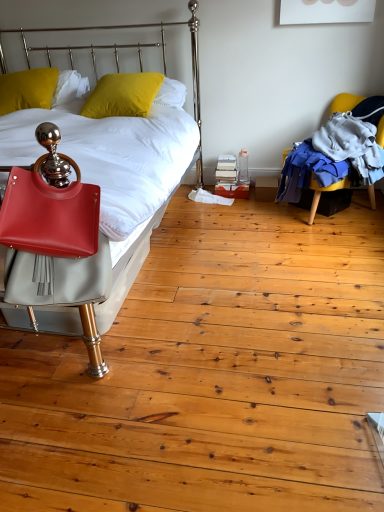
Question: In terms of width, does yellow matte pillow at upper left, which is the first pillow in right-to-left order, look wider or thinner when compared to matte leather bed at left?

Choices:
 (A) wide
 (B) thin

Answer: (B)

Question: Is yellow matte pillow at upper left, the 2th pillow viewed from the left, taller or shorter than matte leather bed at left?

Choices:
 (A) short
 (B) tall

Answer: (A)

Question: Considering the real-world distances, which object is closest to the matte leather bed at left?

Choices:
 (A) matte red handbag at left
 (B) yellow fabric chair at right
 (C) yellow matte pillow at upper left, which is the first pillow in right-to-left order
 (D) yellow matte pillow at upper left, which is counted as the 1th pillow, starting from the left

Answer: (A)

Question: Which is nearer to the yellow matte pillow at upper left, which is the first pillow in right-to-left order?

Choices:
 (A) yellow fabric chair at right
 (B) matte leather bed at left
 (C) matte red handbag at left
 (D) yellow matte pillow at upper left, which is counted as the 1th pillow, starting from the left

Answer: (D)